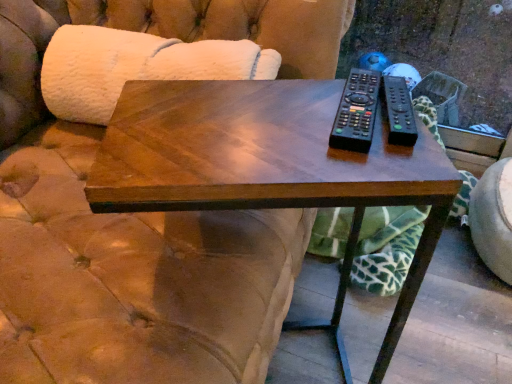
Question: Could you tell me if black plastic remote at upper right, positioned as the second remote in right-to-left order, is turned towards shiny wood coffee table at center?

Choices:
 (A) yes
 (B) no

Answer: (B)

Question: Can you confirm if black plastic remote at upper right, the 1th remote from the left, is positioned to the left of shiny wood coffee table at center?

Choices:
 (A) yes
 (B) no

Answer: (B)

Question: Is black plastic remote at upper right, positioned as the second remote in right-to-left order, surrounding shiny wood coffee table at center?

Choices:
 (A) no
 (B) yes

Answer: (A)

Question: Is black plastic remote at upper right, positioned as the second remote in right-to-left order, not inside shiny wood coffee table at center?

Choices:
 (A) no
 (B) yes

Answer: (B)

Question: Considering the relative sizes of black plastic remote at upper right, positioned as the second remote in right-to-left order, and shiny wood coffee table at center in the image provided, is black plastic remote at upper right, positioned as the second remote in right-to-left order, smaller than shiny wood coffee table at center?

Choices:
 (A) yes
 (B) no

Answer: (A)

Question: From the image's perspective, is white fluffy couch at upper left above or below shiny wood coffee table at center?

Choices:
 (A) above
 (B) below

Answer: (A)

Question: In the image, is white fluffy couch at upper left positioned in front of or behind shiny wood coffee table at center?

Choices:
 (A) front
 (B) behind

Answer: (B)

Question: Is point (3, 18) positioned closer to the camera than point (379, 160)?

Choices:
 (A) farther
 (B) closer

Answer: (A)

Question: Which is correct: white fluffy couch at upper left is inside shiny wood coffee table at center, or outside of it?

Choices:
 (A) inside
 (B) outside

Answer: (B)

Question: From the image's perspective, is black plastic remote at upper right, positioned as the second remote in right-to-left order, above or below shiny wood coffee table at center?

Choices:
 (A) below
 (B) above

Answer: (B)

Question: From a real-world perspective, relative to shiny wood coffee table at center, is black plastic remote at upper right, positioned as the second remote in right-to-left order, vertically above or below?

Choices:
 (A) below
 (B) above

Answer: (B)

Question: Considering the relative positions of black plastic remote at upper right, positioned as the second remote in right-to-left order, and shiny wood coffee table at center in the image provided, is black plastic remote at upper right, positioned as the second remote in right-to-left order, to the left or to the right of shiny wood coffee table at center?

Choices:
 (A) left
 (B) right

Answer: (B)

Question: Is point (357, 122) closer or farther from the camera than point (314, 162)?

Choices:
 (A) closer
 (B) farther

Answer: (B)

Question: From the image's perspective, is white fluffy couch at upper left positioned above or below black plastic remote at right, marked as the second remote in a left-to-right arrangement?

Choices:
 (A) above
 (B) below

Answer: (A)

Question: From a real-world perspective, is white fluffy couch at upper left above or below black plastic remote at right, marked as the second remote in a left-to-right arrangement?

Choices:
 (A) above
 (B) below

Answer: (B)